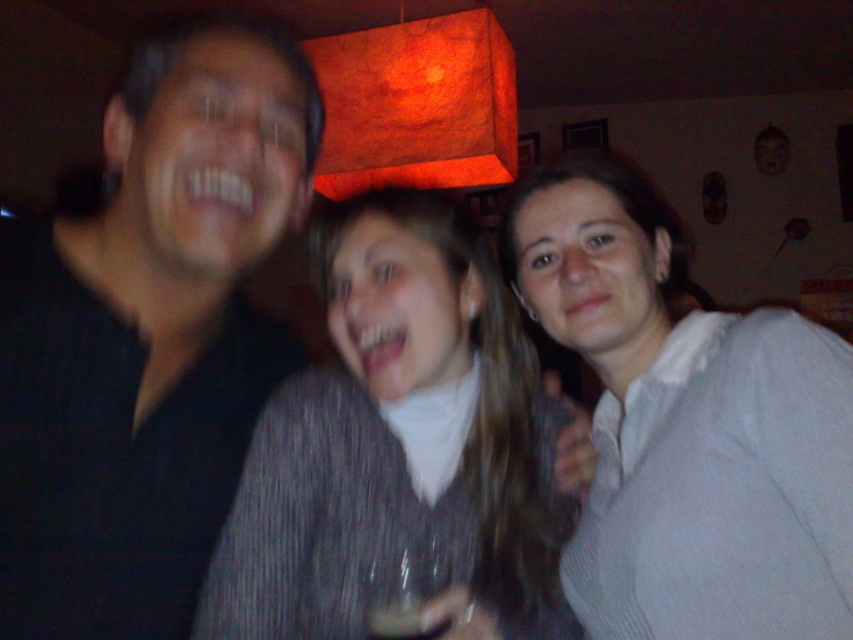
Is point (228, 481) closer to viewer compared to point (624, 385)?

Yes.

Does black matte shirt at left appear on the right side of white textured shirt at center?

Incorrect, black matte shirt at left is not on the right side of white textured shirt at center.

The width and height of the screenshot is (853, 640). Describe the element at coordinates (148, 337) in the screenshot. I see `black matte shirt at left` at that location.

This screenshot has height=640, width=853. In order to click on black matte shirt at left in this screenshot , I will do `click(148, 337)`.

Does white textured shirt at center have a smaller size compared to striped sweater at center?

No, white textured shirt at center is not smaller than striped sweater at center.

Does white textured shirt at center come in front of striped sweater at center?

That is True.

Describe the element at coordinates (688, 428) in the screenshot. I see `white textured shirt at center` at that location.

What are the coordinates of `white textured shirt at center` in the screenshot? It's located at (688, 428).

Does black matte shirt at left have a lesser height compared to striped sweater at center?

In fact, black matte shirt at left may be taller than striped sweater at center.

Does point (38, 461) lie behind point (492, 612)?

No, it is in front of (492, 612).

Locate an element on the screen. This screenshot has height=640, width=853. black matte shirt at left is located at coordinates (148, 337).